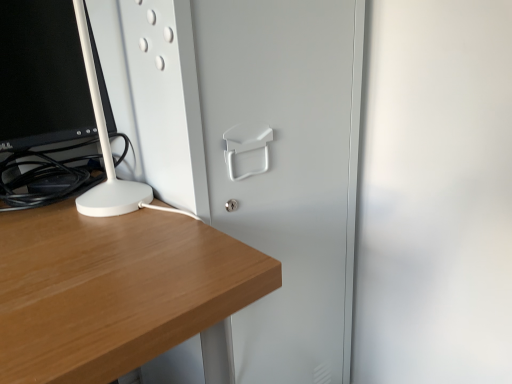
Measure the distance between point (62, 118) and camera.

The depth of point (62, 118) is 29.21 inches.

In order to click on black glossy computer monitor at left in this screenshot , I will do `click(41, 75)`.

What do you see at coordinates (41, 75) in the screenshot? I see `black glossy computer monitor at left` at bounding box center [41, 75].

In order to face black glossy computer monitor at left, should I rotate leftwards or rightwards?

Rotate your view left by about 26.701°.

In order to click on white matte glass door at center in this screenshot , I will do `click(285, 170)`.

Measure the distance between white matte glass door at center and camera.

white matte glass door at center is 21.65 inches away from camera.

The image size is (512, 384). What do you see at coordinates (285, 170) in the screenshot?
I see `white matte glass door at center` at bounding box center [285, 170].

The height and width of the screenshot is (384, 512). I want to click on black glossy computer monitor at left, so click(41, 75).

Is black glossy computer monitor at left at the right side of white matte glass door at center?

Incorrect, black glossy computer monitor at left is not on the right side of white matte glass door at center.

Considering the positions of objects black glossy computer monitor at left and white matte glass door at center in the image provided, who is behind, black glossy computer monitor at left or white matte glass door at center?

black glossy computer monitor at left is further away from the camera.

Does point (102, 77) appear closer or farther from the camera than point (289, 186)?

Clearly, point (102, 77) is closer to the camera than point (289, 186).

From the image's perspective, which is below, black glossy computer monitor at left or white matte glass door at center?

white matte glass door at center, from the image's perspective.

From a real-world perspective, is black glossy computer monitor at left physically above white matte glass door at center?

Indeed, from a real-world perspective, black glossy computer monitor at left stands above white matte glass door at center.

Is black glossy computer monitor at left thinner than white matte glass door at center?

Yes.

Considering the relative sizes of black glossy computer monitor at left and white matte glass door at center in the image provided, is black glossy computer monitor at left taller than white matte glass door at center?

No.

Based on their sizes in the image, would you say black glossy computer monitor at left is bigger or smaller than white matte glass door at center?

Considering their sizes, black glossy computer monitor at left takes up less space than white matte glass door at center.

Is black glossy computer monitor at left not within white matte glass door at center?

Yes.

Is black glossy computer monitor at left positioned far away from white matte glass door at center?

black glossy computer monitor at left is near white matte glass door at center, not far away.

Could you tell me if black glossy computer monitor at left is facing white matte glass door at center?

No.

Can you tell me how much black glossy computer monitor at left and white matte glass door at center differ in facing direction?

3.57 degrees.

Where is `computer monitor behind the white matte glass door at center`? Image resolution: width=512 pixels, height=384 pixels. computer monitor behind the white matte glass door at center is located at coordinates (41, 75).

In the image, is white matte glass door at center on the left side or the right side of black glossy computer monitor at left?

Clearly, white matte glass door at center is on the right of black glossy computer monitor at left in the image.

Is white matte glass door at center positioned before black glossy computer monitor at left?

Yes, it is in front of black glossy computer monitor at left.

Which point is more distant from viewer, (313, 165) or (41, 101)?

Positioned behind is point (313, 165).

From the image's perspective, which one is positioned lower, white matte glass door at center or black glossy computer monitor at left?

white matte glass door at center.

From a real-world perspective, is white matte glass door at center positioned under black glossy computer monitor at left based on gravity?

Yes, from a real-world perspective, white matte glass door at center is under black glossy computer monitor at left.

Which of these two, white matte glass door at center or black glossy computer monitor at left, is wider?

Wider between the two is white matte glass door at center.

Between white matte glass door at center and black glossy computer monitor at left, which one has less height?

With less height is black glossy computer monitor at left.

Is white matte glass door at center bigger than black glossy computer monitor at left?

Yes, white matte glass door at center is bigger than black glossy computer monitor at left.

Can black glossy computer monitor at left be found inside white matte glass door at center?

No, black glossy computer monitor at left is not inside white matte glass door at center.

Is white matte glass door at center not close to black glossy computer monitor at left?

white matte glass door at center is near black glossy computer monitor at left, not far away.

Based on the photo, could you tell me if white matte glass door at center is facing black glossy computer monitor at left?

No, white matte glass door at center is not oriented towards black glossy computer monitor at left.

Can you tell me how much white matte glass door at center and black glossy computer monitor at left differ in facing direction?

They differ by 3.57 degrees in their facing directions.

The width and height of the screenshot is (512, 384). Find the location of `computer monitor above the white matte glass door at center (from a real-world perspective)`. computer monitor above the white matte glass door at center (from a real-world perspective) is located at coordinates (41, 75).

You are a GUI agent. You are given a task and a screenshot of the screen. Output one action in this format:
    pyautogui.click(x=<x>, y=<y>)
    Task: Click on the glass door lying on the right of black glossy computer monitor at left
    The height and width of the screenshot is (384, 512).
    Given the screenshot: What is the action you would take?
    pyautogui.click(x=285, y=170)

Where is `glass door directly beneath the black glossy computer monitor at left (from a real-world perspective)`? glass door directly beneath the black glossy computer monitor at left (from a real-world perspective) is located at coordinates (285, 170).